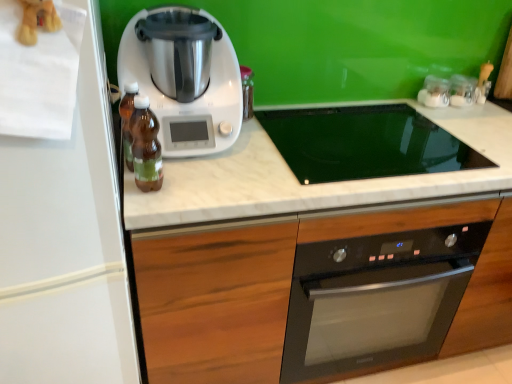
The height and width of the screenshot is (384, 512). Find the location of `unoccupied area in front of clear glass jars at upper right, which ranks as the second appliance in left-to-right order`. unoccupied area in front of clear glass jars at upper right, which ranks as the second appliance in left-to-right order is located at coordinates (460, 112).